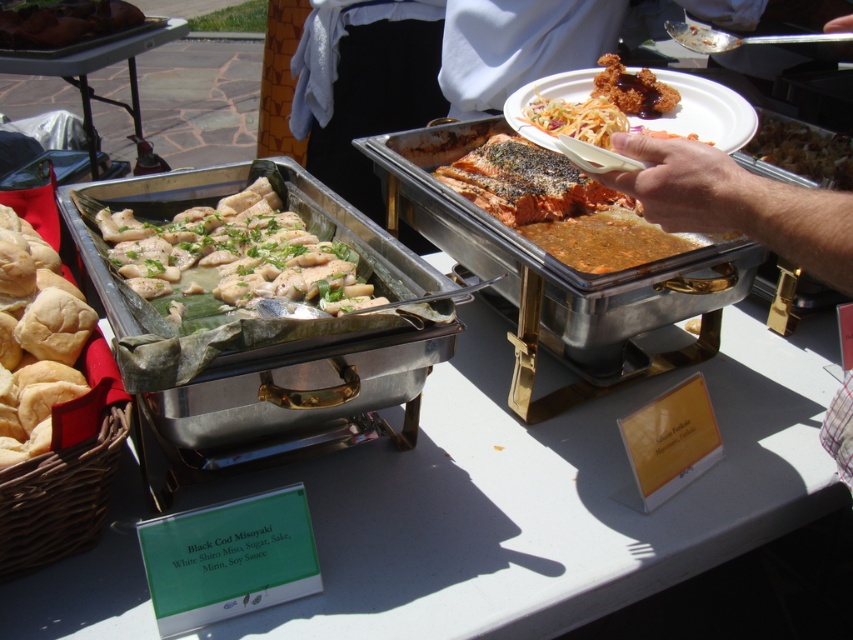
Question: Among these points, which one is nearest to the camera?

Choices:
 (A) (44, 32)
 (B) (650, 228)
 (C) (831, 170)
 (D) (573, 83)

Answer: (B)

Question: Among these objects, which one is farthest from the camera?

Choices:
 (A) matte brown bread at left
 (B) brushed metal tray at upper left
 (C) shiny brown salmon at center
 (D) white plastic plate at upper right

Answer: (A)

Question: Which of the following is the farthest from the observer?

Choices:
 (A) (714, 120)
 (B) (509, 173)

Answer: (B)

Question: Does white plastic plate at upper right have a larger size compared to brushed metal tray at upper left?

Choices:
 (A) no
 (B) yes

Answer: (A)

Question: Does golden brown bread at lower left come behind brown matte sauce at center?

Choices:
 (A) yes
 (B) no

Answer: (B)

Question: Is golden brown bread at lower left wider than brown crispy rice at center?

Choices:
 (A) no
 (B) yes

Answer: (A)